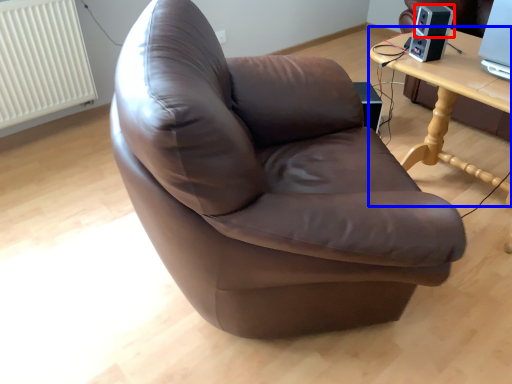
Question: Which object appears closest to the camera in this image, speaker (highlighted by a red box) or table (highlighted by a blue box)?

Choices:
 (A) speaker
 (B) table

Answer: (B)